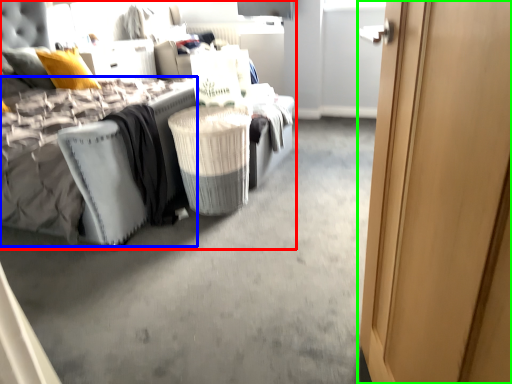
Question: Which object is the farthest from bed (highlighted by a red box)? Choose among these: mattress (highlighted by a blue box) or door (highlighted by a green box).

Choices:
 (A) mattress
 (B) door

Answer: (B)